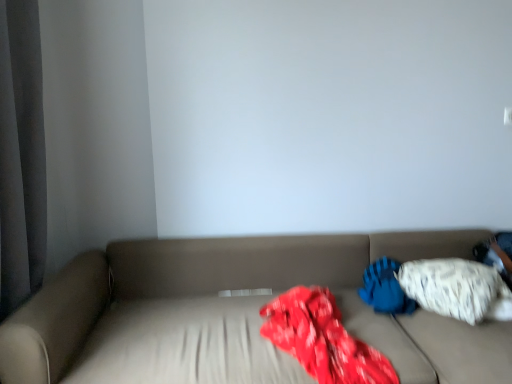
Question: Should I look upward or downward to see white soft pillow at right, acting as the first pillow starting from the left?

Choices:
 (A) up
 (B) down

Answer: (B)

Question: From the image's perspective, is white soft pillow at right, marked as the 2th pillow in a right-to-left arrangement, located above white textured pillow at right, placed as the second pillow when sorted from left to right?

Choices:
 (A) yes
 (B) no

Answer: (B)

Question: Does white soft pillow at right, marked as the 2th pillow in a right-to-left arrangement, have a smaller size compared to white textured pillow at right, placed as the first pillow when sorted from right to left?

Choices:
 (A) yes
 (B) no

Answer: (A)

Question: Is white soft pillow at right, acting as the first pillow starting from the left, looking in the opposite direction of white textured pillow at right, placed as the first pillow when sorted from right to left?

Choices:
 (A) yes
 (B) no

Answer: (A)

Question: Can you confirm if white soft pillow at right, marked as the 2th pillow in a right-to-left arrangement, is positioned to the right of white textured pillow at right, placed as the second pillow when sorted from left to right?

Choices:
 (A) no
 (B) yes

Answer: (A)

Question: Is white soft pillow at right, acting as the first pillow starting from the left, positioned in front of white textured pillow at right, placed as the second pillow when sorted from left to right?

Choices:
 (A) no
 (B) yes

Answer: (A)

Question: Are white soft pillow at right, acting as the first pillow starting from the left, and white textured pillow at right, placed as the first pillow when sorted from right to left, located far from each other?

Choices:
 (A) no
 (B) yes

Answer: (A)

Question: Considering the relative sizes of white textured pillow at right, placed as the second pillow when sorted from left to right, and white soft pillow at right, acting as the first pillow starting from the left, in the image provided, is white textured pillow at right, placed as the second pillow when sorted from left to right, smaller than white soft pillow at right, acting as the first pillow starting from the left,?

Choices:
 (A) yes
 (B) no

Answer: (B)

Question: From the image's perspective, is white textured pillow at right, placed as the second pillow when sorted from left to right, above white soft pillow at right, marked as the 2th pillow in a right-to-left arrangement?

Choices:
 (A) no
 (B) yes

Answer: (B)

Question: Considering the relative sizes of white textured pillow at right, placed as the first pillow when sorted from right to left, and white soft pillow at right, marked as the 2th pillow in a right-to-left arrangement, in the image provided, is white textured pillow at right, placed as the first pillow when sorted from right to left, bigger than white soft pillow at right, marked as the 2th pillow in a right-to-left arrangement,?

Choices:
 (A) yes
 (B) no

Answer: (A)

Question: Considering the relative positions of white textured pillow at right, placed as the second pillow when sorted from left to right, and white soft pillow at right, acting as the first pillow starting from the left, in the image provided, is white textured pillow at right, placed as the second pillow when sorted from left to right, behind white soft pillow at right, acting as the first pillow starting from the left,?

Choices:
 (A) yes
 (B) no

Answer: (B)

Question: Is white textured pillow at right, placed as the first pillow when sorted from right to left, beside white soft pillow at right, acting as the first pillow starting from the left?

Choices:
 (A) yes
 (B) no

Answer: (B)

Question: Can you confirm if white textured pillow at right, placed as the second pillow when sorted from left to right, is taller than white soft pillow at right, acting as the first pillow starting from the left?

Choices:
 (A) yes
 (B) no

Answer: (A)

Question: From the image's perspective, would you say white textured pillow at right, placed as the first pillow when sorted from right to left, is shown under beige fabric couch at center?

Choices:
 (A) no
 (B) yes

Answer: (A)